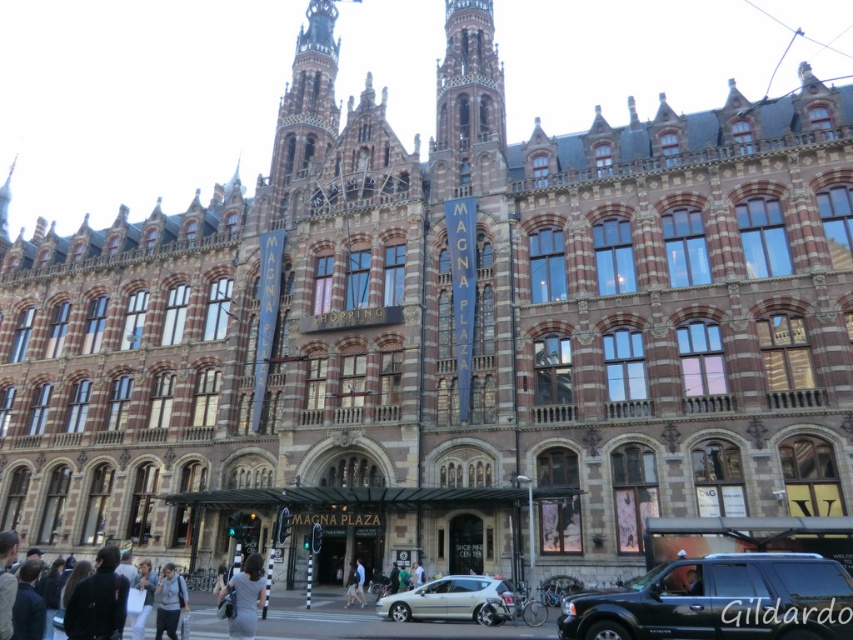
Question: Estimate the real-world distances between objects in this image. Which object is closer to the silver metallic car at center?

Choices:
 (A) dark gray dress at lower center
 (B) light gray fabric jacket at lower center
 (C) shiny black suv at lower right

Answer: (C)

Question: Which object is positioned farthest from the shiny black suv at lower right?

Choices:
 (A) dark gray dress at lower center
 (B) light gray fabric jacket at lower center

Answer: (B)

Question: Can you confirm if shiny black suv at lower right is positioned above dark gray dress at lower center?

Choices:
 (A) yes
 (B) no

Answer: (A)

Question: Does shiny black suv at lower right appear on the left side of light gray fabric jacket at lower center?

Choices:
 (A) no
 (B) yes

Answer: (A)

Question: Estimate the real-world distances between objects in this image. Which object is closer to the light gray fabric jacket at lower center?

Choices:
 (A) shiny black suv at lower right
 (B) silver metallic car at center
 (C) dark gray dress at lower center

Answer: (C)

Question: Is shiny black suv at lower right above silver metallic car at center?

Choices:
 (A) no
 (B) yes

Answer: (B)